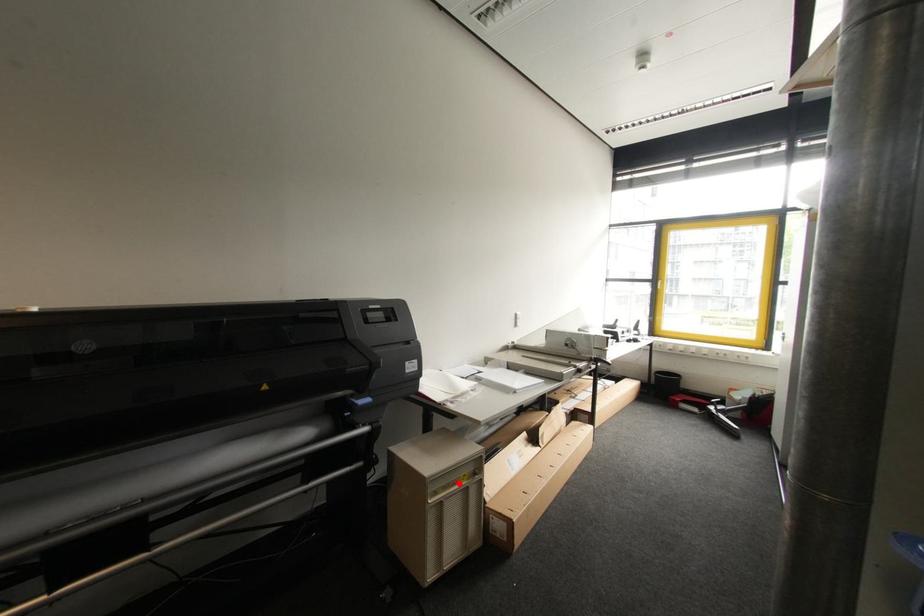
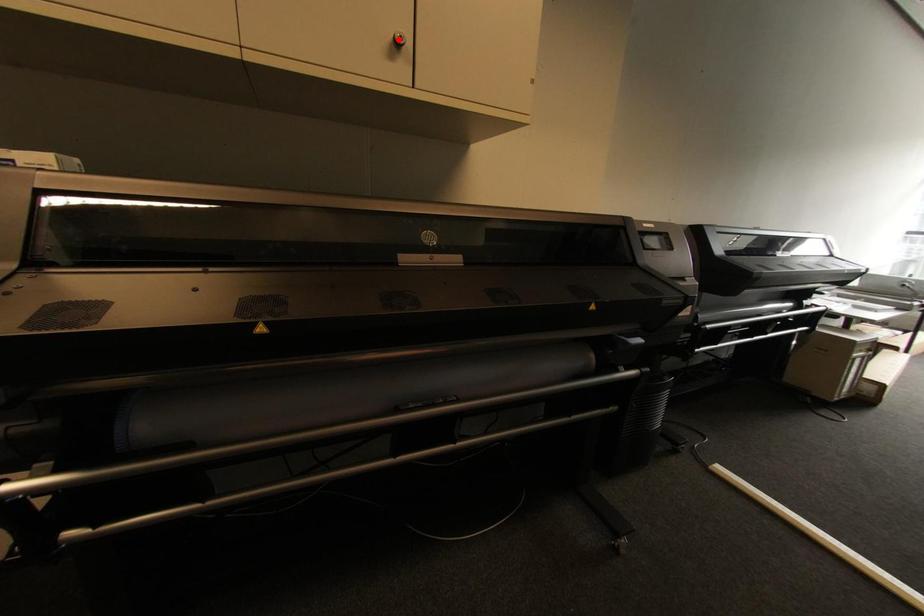
I am providing you with two images of the same scene from different viewpoints. A red point is marked on the first image and another point is marked on the second image. Is the marked point in image1 the same physical position as the marked point in image2?

No